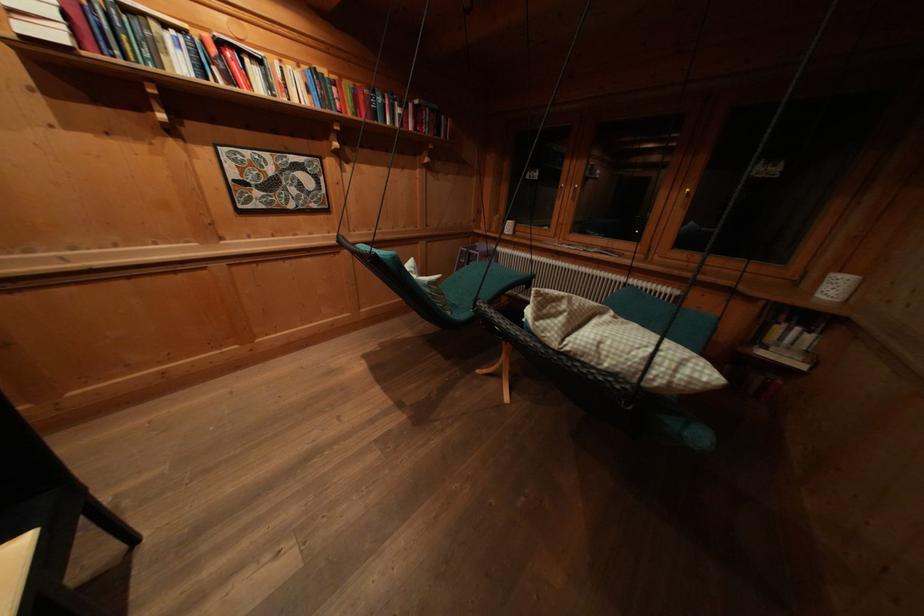
This screenshot has width=924, height=616. Describe the element at coordinates (614, 344) in the screenshot. I see `the checkered pillow` at that location.